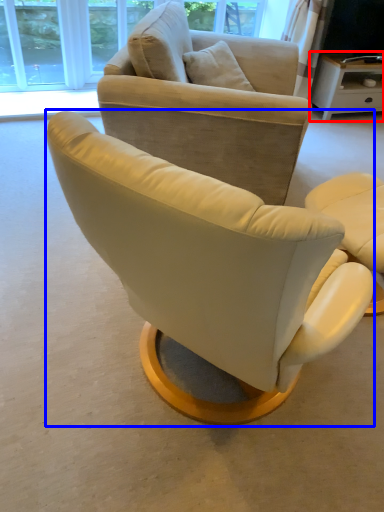
Question: Which of the following is the closest to the observer, desk (highlighted by a red box) or chair (highlighted by a blue box)?

Choices:
 (A) desk
 (B) chair

Answer: (B)